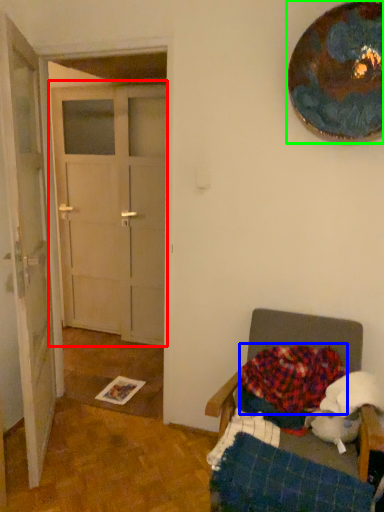
Question: Estimate the real-world distances between objects in this image. Which object is farther from door (highlighted by a red box), blanket (highlighted by a blue box) or oval (highlighted by a green box)?

Choices:
 (A) blanket
 (B) oval

Answer: (B)